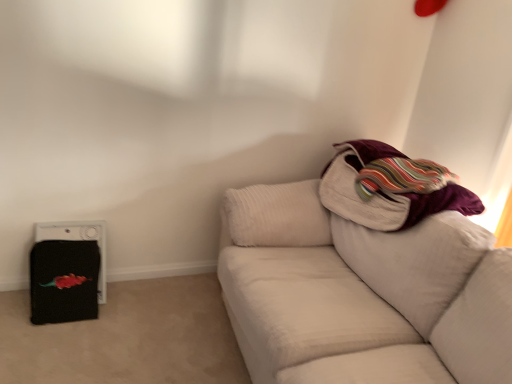
Question: From the image's perspective, does velvet purple blanket at upper right appear higher than white textured couch at right?

Choices:
 (A) yes
 (B) no

Answer: (A)

Question: Is velvet purple blanket at upper right further to the viewer compared to white textured couch at right?

Choices:
 (A) yes
 (B) no

Answer: (A)

Question: Is velvet purple blanket at upper right outside white textured couch at right?

Choices:
 (A) yes
 (B) no

Answer: (B)

Question: Can you confirm if velvet purple blanket at upper right is positioned to the right of white textured couch at right?

Choices:
 (A) yes
 (B) no

Answer: (A)

Question: Is velvet purple blanket at upper right bigger than white textured couch at right?

Choices:
 (A) yes
 (B) no

Answer: (B)

Question: Is velvet purple blanket at upper right wider than white textured couch at right?

Choices:
 (A) no
 (B) yes

Answer: (A)

Question: Does black fabric at left turn towards white textured couch at right?

Choices:
 (A) no
 (B) yes

Answer: (A)

Question: Does black fabric at left lie behind white textured couch at right?

Choices:
 (A) no
 (B) yes

Answer: (B)

Question: Is white textured couch at right located within black fabric at left?

Choices:
 (A) no
 (B) yes

Answer: (A)

Question: Considering the relative positions of black fabric at left and white textured couch at right in the image provided, is black fabric at left in front of white textured couch at right?

Choices:
 (A) yes
 (B) no

Answer: (B)

Question: Is black fabric at left wider than white textured couch at right?

Choices:
 (A) no
 (B) yes

Answer: (A)

Question: Can you confirm if black fabric at left is thinner than white textured couch at right?

Choices:
 (A) no
 (B) yes

Answer: (B)

Question: Is white textured couch at right smaller than velvet purple blanket at upper right?

Choices:
 (A) no
 (B) yes

Answer: (A)